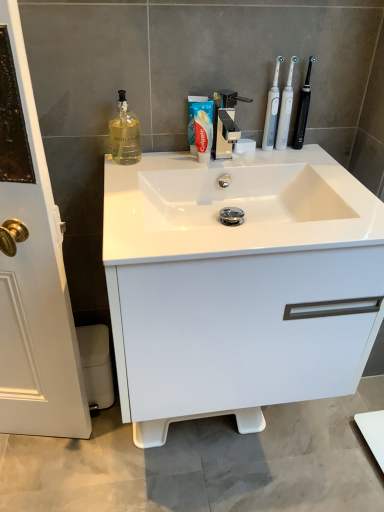
The width and height of the screenshot is (384, 512). I want to click on vacant area that is situated to the right of white matte toothpaste at center, so click(x=263, y=161).